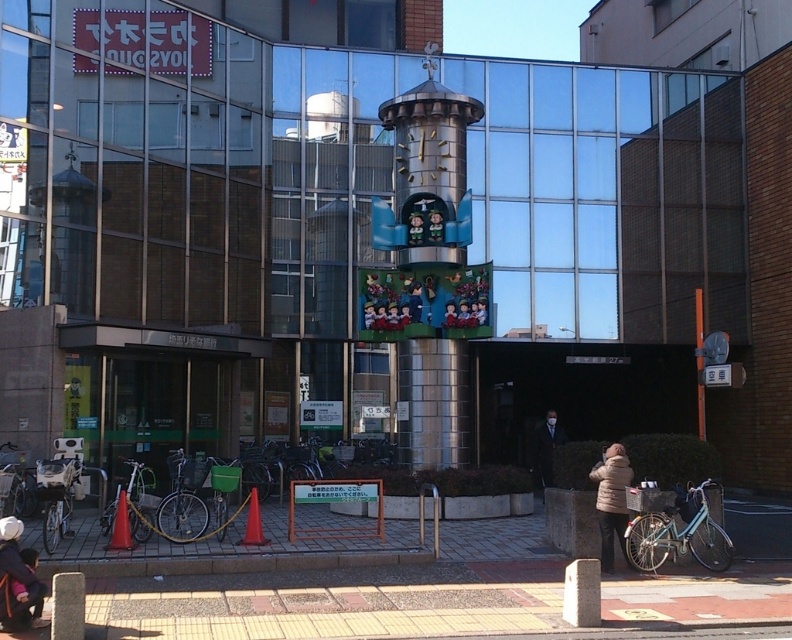
Measure the distance between polished silver clock tower at center and camera.

They are 17.77 meters apart.

In the scene shown: Who is taller, polished silver clock tower at center or dark gray suit at center?

Standing taller between the two is dark gray suit at center.

Describe the element at coordinates (429, 269) in the screenshot. The height and width of the screenshot is (640, 792). I see `polished silver clock tower at center` at that location.

Image resolution: width=792 pixels, height=640 pixels. Find the location of `polished silver clock tower at center`. polished silver clock tower at center is located at coordinates (429, 269).

Can you confirm if white puffy coat at lower right is bigger than dark gray suit at center?

No, white puffy coat at lower right is not bigger than dark gray suit at center.

This screenshot has width=792, height=640. Find the location of `white puffy coat at lower right`. white puffy coat at lower right is located at coordinates (611, 500).

What do you see at coordinates (611, 500) in the screenshot?
I see `white puffy coat at lower right` at bounding box center [611, 500].

This screenshot has width=792, height=640. Identify the location of white puffy coat at lower right. (611, 500).

Who is more forward, (440, 614) or (607, 545)?

Point (440, 614)

Between brick pavement at lower center and white puffy coat at lower right, which one is positioned lower?

Positioned lower is brick pavement at lower center.

Between point (608, 602) and point (604, 516), which one is positioned in front?

Point (608, 602)

The image size is (792, 640). In order to click on brick pavement at lower center in this screenshot , I will do `click(318, 609)`.